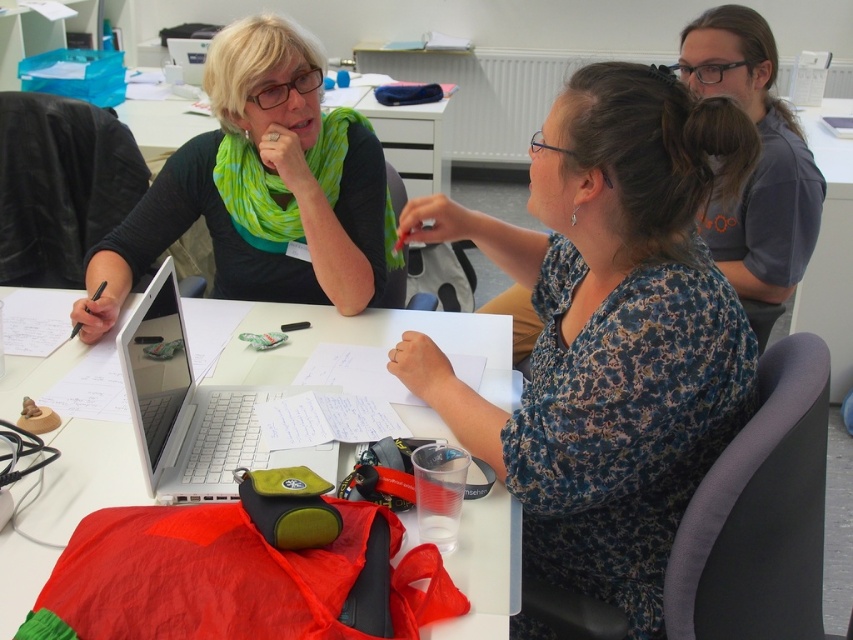
Question: Which of these objects is positioned farthest from the matte black laptop at left?

Choices:
 (A) floral dress at center
 (B) white plastic table at upper center
 (C) white paper at center

Answer: (B)

Question: Is white matte laptop at center smaller than white plastic table at upper center?

Choices:
 (A) yes
 (B) no

Answer: (A)

Question: Which is farther from the matte black laptop at left?

Choices:
 (A) white matte laptop at center
 (B) floral dress at center
 (C) white paper at center
 (D) white plastic table at upper center

Answer: (D)

Question: Which point appears farthest from the camera in this image?

Choices:
 (A) (811, 129)
 (B) (51, 307)

Answer: (A)

Question: Considering the relative positions of floral dress at center and white paper at center in the image provided, where is floral dress at center located with respect to white paper at center?

Choices:
 (A) right
 (B) left

Answer: (A)

Question: Is matte black laptop at left closer to the viewer compared to white matte laptop at center?

Choices:
 (A) no
 (B) yes

Answer: (A)